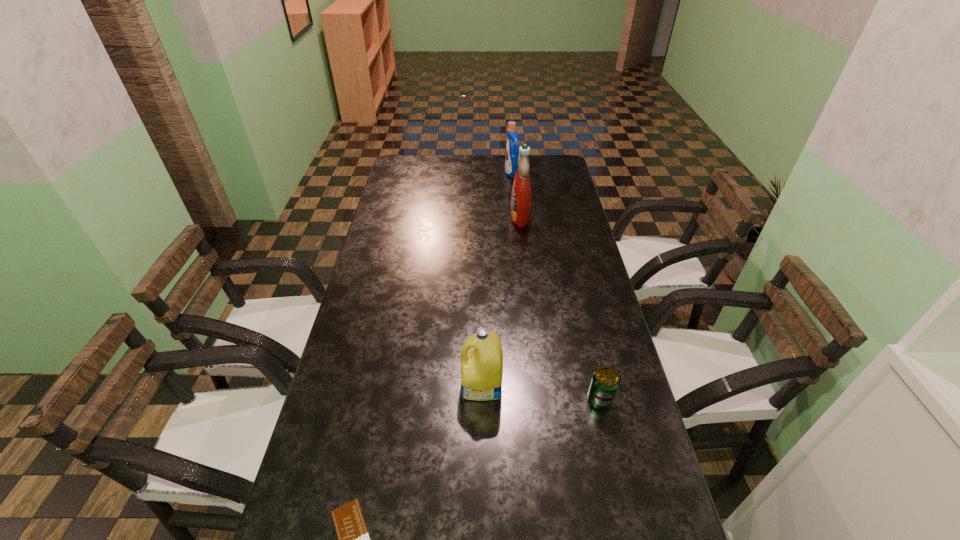
Identify the location of vacant area located on the label of the farthest detergent. The width and height of the screenshot is (960, 540). (422, 173).

Identify the location of vacant space situated on the label of the farthest detergent. The height and width of the screenshot is (540, 960). (436, 173).

This screenshot has height=540, width=960. Find the location of `vacant space located 0.390m on the label of the farthest detergent`. vacant space located 0.390m on the label of the farthest detergent is located at coordinates (418, 173).

You are a GUI agent. You are given a task and a screenshot of the screen. Output one action in this format:
    pyautogui.click(x=<x>, y=<y>)
    Task: Click on the free location located on the label of the nearest detergent
    
    Given the screenshot: What is the action you would take?
    pyautogui.click(x=350, y=385)

At what (x,y) coordinates should I click in order to perform the action: click on free space located 0.260m on the label of the nearest detergent. Please return your answer as a coordinate pair (x, y). Looking at the image, I should click on (362, 385).

Locate an element on the screen. vacant space located 0.090m on the label of the nearest detergent is located at coordinates (427, 385).

Where is `free space located on the back of the rightmost object`? The width and height of the screenshot is (960, 540). free space located on the back of the rightmost object is located at coordinates (590, 357).

You are a GUI agent. You are given a task and a screenshot of the screen. Output one action in this format:
    pyautogui.click(x=<x>, y=<y>)
    Task: Click on the object positioned at the far edge
    Image resolution: width=960 pixels, height=540 pixels.
    Given the screenshot: What is the action you would take?
    pyautogui.click(x=512, y=149)

You are a GUI agent. You are given a task and a screenshot of the screen. Output one action in this format:
    pyautogui.click(x=<x>, y=<y>)
    Task: Click on the object located in the right edge section of the desktop
    Image resolution: width=960 pixels, height=540 pixels.
    Given the screenshot: What is the action you would take?
    pyautogui.click(x=605, y=382)

Where is `free spot at the far edge of the desktop`? The width and height of the screenshot is (960, 540). free spot at the far edge of the desktop is located at coordinates (475, 166).